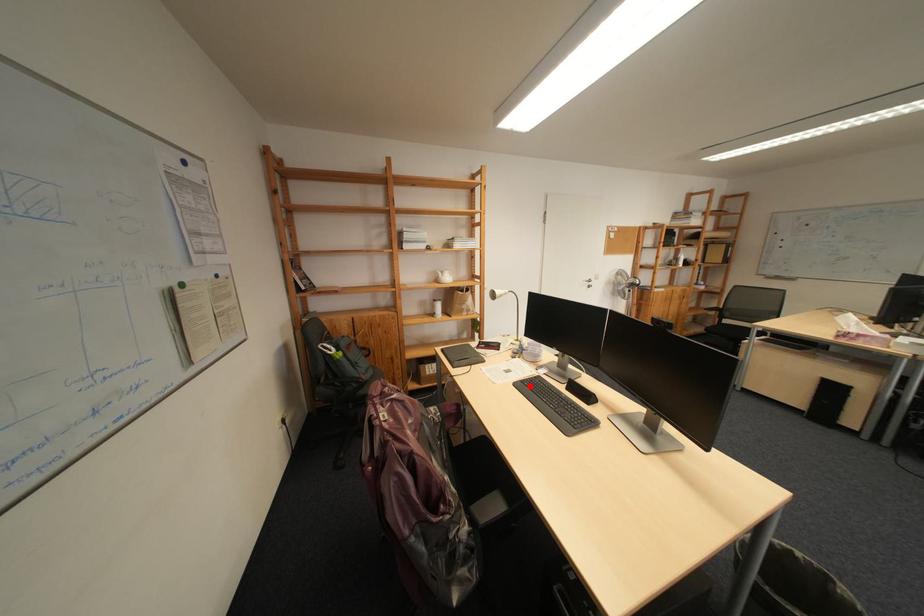
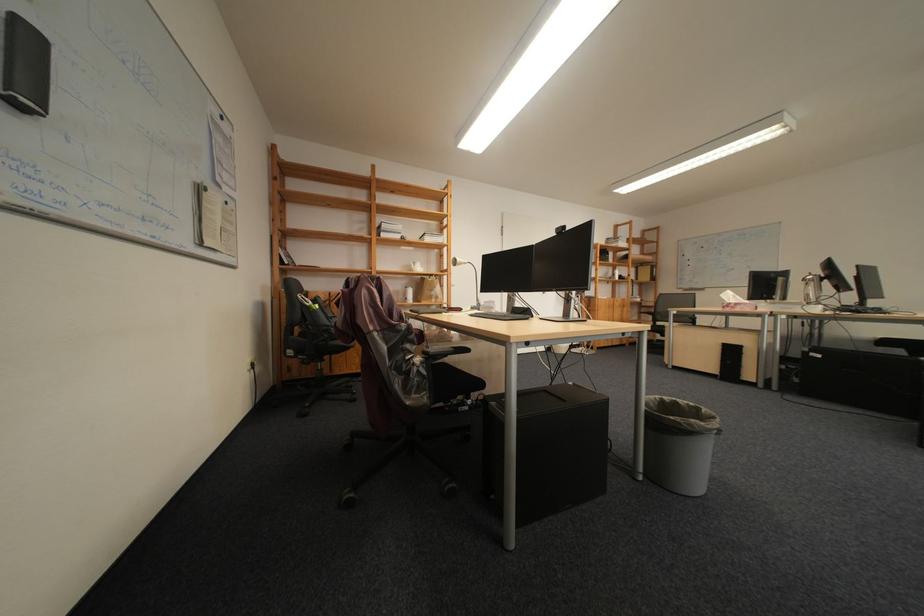
Question: I am providing you with two images of the same scene from different viewpoints. A red point is marked on the first image. At the location where the point appears in image 1, is it still visible in image 2?

Choices:
 (A) Yes
 (B) No

Answer: (A)